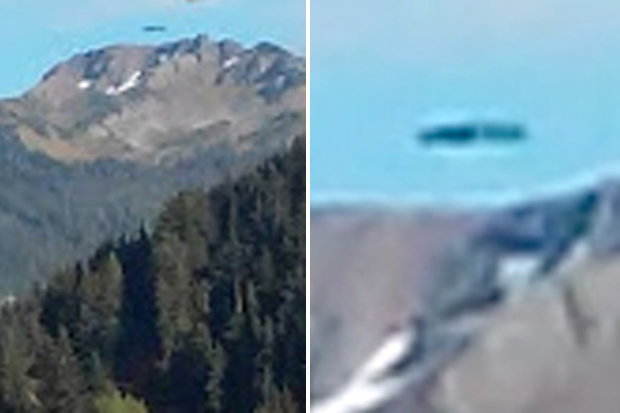
Locate an element on the screen. This screenshot has width=620, height=413. rod is located at coordinates (479, 129).